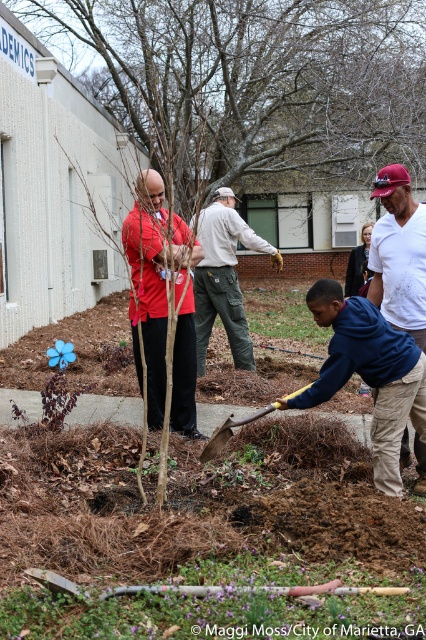
Between point (399, 477) and point (229, 429), which one is positioned behind?

Point (229, 429)

Does blue cotton hoodie at center lie behind yellow wood shovel at center?

No, it is not.

At what (x,y) coordinates should I click in order to perform the action: click on blue cotton hoodie at center. Please return your answer as a coordinate pair (x, y). The image size is (426, 640). Looking at the image, I should click on (368, 372).

Which is in front, point (340, 64) or point (152, 388)?

Point (152, 388)

Is point (86, 12) less distant than point (166, 301)?

No, it is behind (166, 301).

Find the location of a particular element. bare branches at center is located at coordinates (253, 81).

Is khaki cargo pants at center further to the viewer compared to yellow wood shovel at center?

Yes, it is.

Is khaki cargo pants at center above yellow wood shovel at center?

Indeed, khaki cargo pants at center is positioned over yellow wood shovel at center.

Does point (230, 317) come farther from viewer compared to point (275, 403)?

That is True.

Locate an element on the screen. Image resolution: width=426 pixels, height=640 pixels. khaki cargo pants at center is located at coordinates (224, 276).